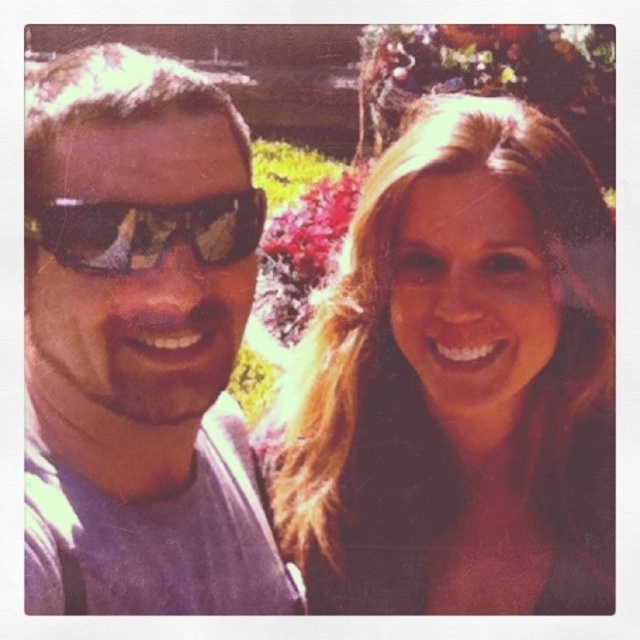
Can you confirm if matte gray shirt at left is taller than black reflective sunglasses at left?

Correct, matte gray shirt at left is much taller as black reflective sunglasses at left.

Can you confirm if matte gray shirt at left is shorter than black reflective sunglasses at left?

In fact, matte gray shirt at left may be taller than black reflective sunglasses at left.

Is point (61, 96) positioned before point (150, 205)?

No, (61, 96) is further to viewer.

Locate an element on the screen. matte gray shirt at left is located at coordinates (140, 344).

Between blonde hair at center and matte gray shirt at left, which one appears on the right side from the viewer's perspective?

blonde hair at center is more to the right.

The width and height of the screenshot is (640, 640). In order to click on blonde hair at center in this screenshot , I will do `click(458, 381)`.

Between point (515, 358) and point (132, 442), which one is positioned in front?

Point (132, 442) is in front.

Locate an element on the screen. blonde hair at center is located at coordinates (458, 381).

Measure the distance between point (378, 500) and camera.

Point (378, 500) and camera are 4.33 feet apart from each other.

Is blonde hair at center closer to camera compared to black reflective sunglasses at left?

No, it is not.

The width and height of the screenshot is (640, 640). Find the location of `blonde hair at center`. blonde hair at center is located at coordinates (458, 381).